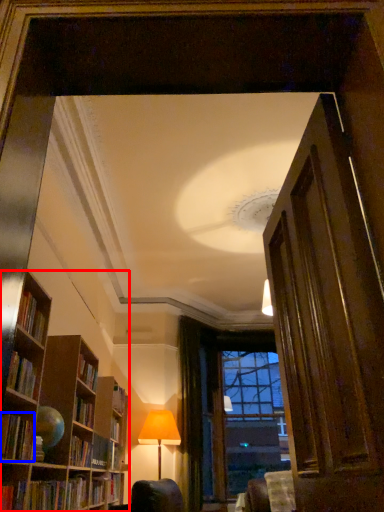
Question: Among these objects, which one is farthest to the camera, bookcase (highlighted by a red box) or book (highlighted by a blue box)?

Choices:
 (A) bookcase
 (B) book

Answer: (B)